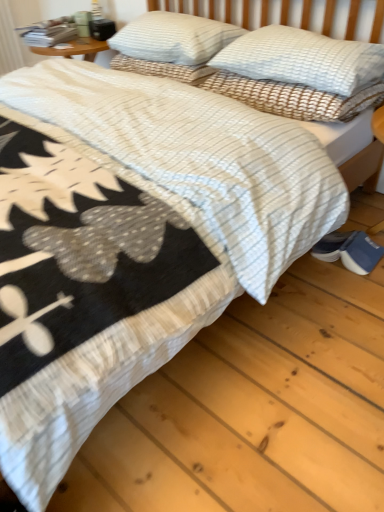
Question: Is white textured pillow at upper right, the second pillow positioned from the left, aimed at white textured pillow at upper center, placed as the 3th pillow when sorted from left to right?

Choices:
 (A) yes
 (B) no

Answer: (B)

Question: Is white textured pillow at upper right, placed as the second pillow when sorted from right to left, positioned in front of white textured pillow at upper center, placed as the 3th pillow when sorted from left to right?

Choices:
 (A) yes
 (B) no

Answer: (B)

Question: Is the surface of white textured pillow at upper right, placed as the second pillow when sorted from right to left, in direct contact with white textured pillow at upper center, the first pillow from the right?

Choices:
 (A) yes
 (B) no

Answer: (A)

Question: Considering the relative sizes of white textured pillow at upper right, the second pillow positioned from the left, and white textured pillow at upper center, placed as the 3th pillow when sorted from left to right, in the image provided, is white textured pillow at upper right, the second pillow positioned from the left, thinner than white textured pillow at upper center, placed as the 3th pillow when sorted from left to right,?

Choices:
 (A) no
 (B) yes

Answer: (B)

Question: Can you confirm if white textured pillow at upper right, the second pillow positioned from the left, is bigger than white textured pillow at upper center, placed as the 3th pillow when sorted from left to right?

Choices:
 (A) no
 (B) yes

Answer: (A)

Question: Choose the correct answer: Is white textured pillow at upper right, the second pillow positioned from the left, inside white textured pillow at upper center, the 3th pillow from the right, or outside it?

Choices:
 (A) inside
 (B) outside

Answer: (B)

Question: From a real-world perspective, is white textured pillow at upper right, placed as the second pillow when sorted from right to left, above or below white textured pillow at upper center, the 3th pillow from the right?

Choices:
 (A) below
 (B) above

Answer: (A)

Question: Would you say white textured pillow at upper right, placed as the second pillow when sorted from right to left, is to the left or to the right of white textured pillow at upper center, the first pillow in the left-to-right sequence, in the picture?

Choices:
 (A) left
 (B) right

Answer: (B)

Question: Does point (365, 99) appear closer or farther from the camera than point (187, 56)?

Choices:
 (A) farther
 (B) closer

Answer: (B)

Question: In the image, is white textured pillow at upper center, the first pillow in the left-to-right sequence, positioned in front of or behind blue suede shoes at lower right?

Choices:
 (A) front
 (B) behind

Answer: (B)

Question: From the image's perspective, relative to blue suede shoes at lower right, is white textured pillow at upper center, the 3th pillow from the right, above or below?

Choices:
 (A) above
 (B) below

Answer: (A)

Question: Visually, is white textured pillow at upper center, the first pillow in the left-to-right sequence, positioned to the left or to the right of blue suede shoes at lower right?

Choices:
 (A) left
 (B) right

Answer: (A)

Question: Would you say white textured pillow at upper center, the first pillow in the left-to-right sequence, is inside or outside blue suede shoes at lower right?

Choices:
 (A) outside
 (B) inside

Answer: (A)

Question: From a real-world perspective, relative to white textured pillow at upper right, placed as the second pillow when sorted from right to left, is white textured pillow at upper center, the first pillow from the right, vertically above or below?

Choices:
 (A) below
 (B) above

Answer: (B)

Question: In terms of width, does white textured pillow at upper center, placed as the 3th pillow when sorted from left to right, look wider or thinner when compared to white textured pillow at upper right, the second pillow positioned from the left?

Choices:
 (A) wide
 (B) thin

Answer: (A)